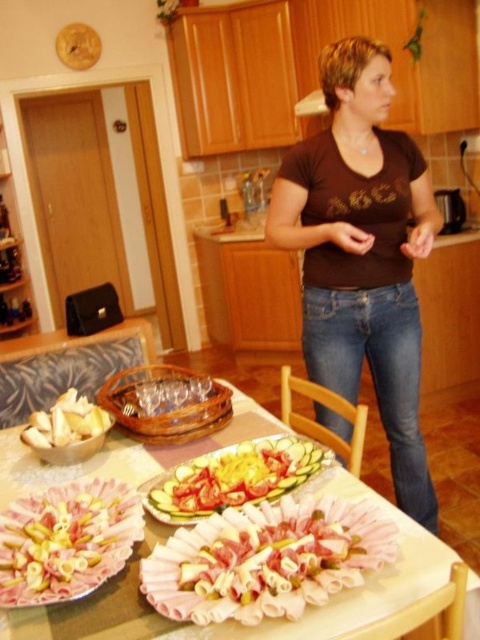
How much distance is there between pink glossy rolled meat at center and white crumbly at lower left?

pink glossy rolled meat at center and white crumbly at lower left are 13.58 inches apart.

Is pink glossy rolled meat at center above white crumbly at lower left?

No, pink glossy rolled meat at center is not above white crumbly at lower left.

Which is behind, point (45, 563) or point (72, 397)?

The point (72, 397) is behind.

Find the location of a particular element. The width and height of the screenshot is (480, 640). pink glossy rolled meat at center is located at coordinates (64, 541).

Which of these two, pink rolled meat at center or smooth white platter at center, stands shorter?

pink rolled meat at center

Can you confirm if pink rolled meat at center is smaller than smooth white platter at center?

No.

Is point (385, 552) more distant than point (189, 515)?

No, it is in front of (189, 515).

Where is `pink rolled meat at center`? This screenshot has width=480, height=640. pink rolled meat at center is located at coordinates (265, 561).

Who is more forward, (290,150) or (271,449)?

Point (271,449)

Does brown cotton shirt at center have a greater height compared to smooth white platter at center?

Indeed, brown cotton shirt at center has a greater height compared to smooth white platter at center.

Which is behind, point (357, 200) or point (264, 499)?

Point (357, 200)

Identify the location of brown cotton shirt at center. (361, 253).